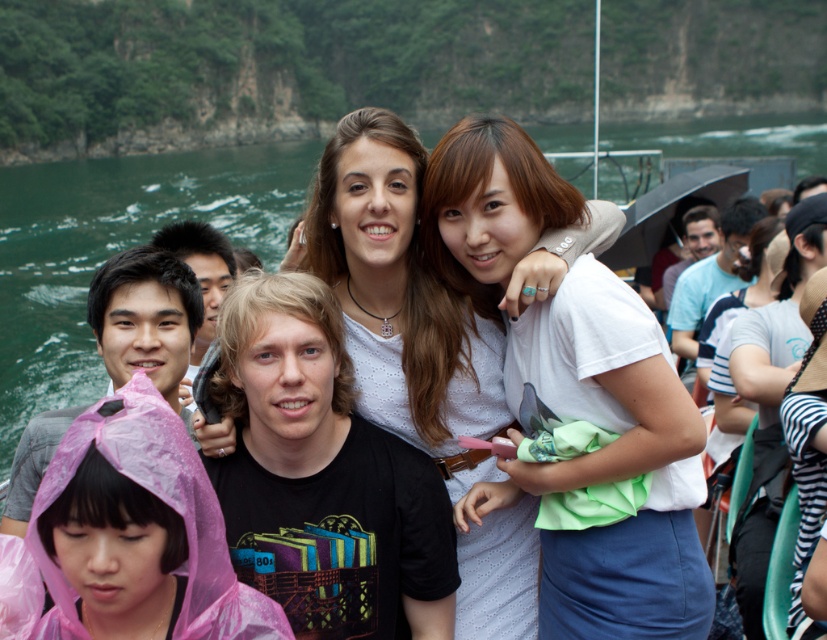
Can you confirm if white cotton shirt at center is wider than pink raincoat at lower left?

Yes, white cotton shirt at center is wider than pink raincoat at lower left.

Does white cotton shirt at center come in front of pink raincoat at lower left?

Yes, white cotton shirt at center is in front of pink raincoat at lower left.

Which is behind, point (691, 483) or point (108, 292)?

The point (108, 292) is behind.

The height and width of the screenshot is (640, 827). Identify the location of white cotton shirt at center. (609, 461).

Identify the location of green water at center. click(x=115, y=250).

Which is in front, point (8, 256) or point (174, 448)?

Point (174, 448)

Is point (89, 401) positioned before point (194, 596)?

That is False.

Where is `green water at center`? The image size is (827, 640). green water at center is located at coordinates (115, 250).

Is pink plastic raincoat at lower left bigger than pink raincoat at lower left?

Correct, pink plastic raincoat at lower left is larger in size than pink raincoat at lower left.

Between pink plastic raincoat at lower left and pink raincoat at lower left, which one is positioned lower?

Positioned lower is pink plastic raincoat at lower left.

Where is `pink plastic raincoat at lower left`? pink plastic raincoat at lower left is located at coordinates (166, 502).